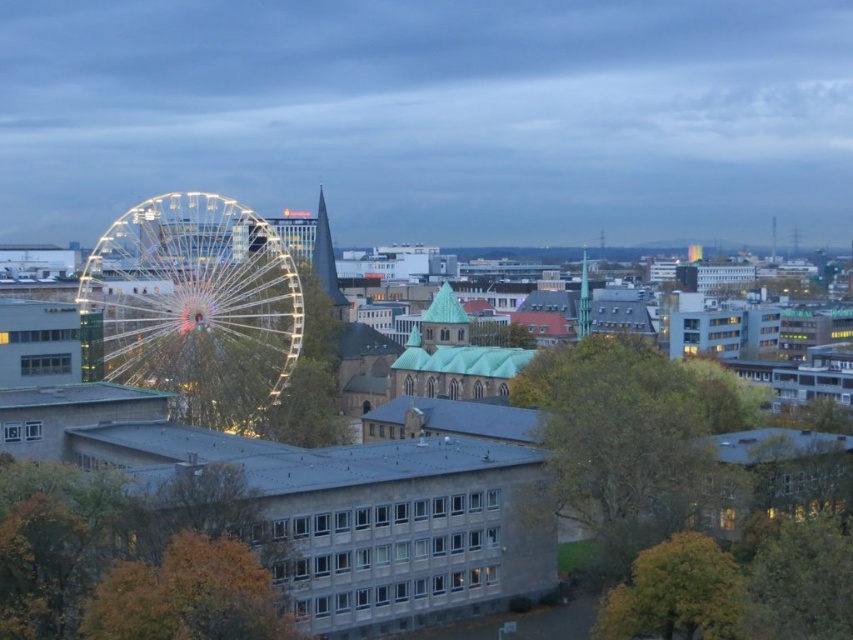
In the scene shown: Between illuminated steel ferris wheel at left and green leafy tree at center, which one appears on the right side from the viewer's perspective?

green leafy tree at center

Does illuminated steel ferris wheel at left lie in front of green leafy tree at center?

No.

Between point (218, 209) and point (705, 484), which one is positioned in front?

Point (705, 484) is more forward.

In order to click on illuminated steel ferris wheel at left in this screenshot , I will do `click(193, 307)`.

Based on the photo, who is shorter, brown leafy tree at lower left or yellow-green leafy tree at lower right?

yellow-green leafy tree at lower right

Does brown leafy tree at lower left have a lesser height compared to yellow-green leafy tree at lower right?

No, brown leafy tree at lower left is not shorter than yellow-green leafy tree at lower right.

Find the location of `brown leafy tree at lower left`. brown leafy tree at lower left is located at coordinates (135, 557).

Can you confirm if illuminated steel ferris wheel at left is positioned above yellow-green leafy tree at lower right?

Indeed, illuminated steel ferris wheel at left is positioned over yellow-green leafy tree at lower right.

Who is more distant from viewer, (242,216) or (701,595)?

Point (242,216)

Between point (138, 237) and point (671, 568), which one is positioned in front?

Point (671, 568) is in front.

The height and width of the screenshot is (640, 853). What are the coordinates of `illuminated steel ferris wheel at left` in the screenshot? It's located at (193, 307).